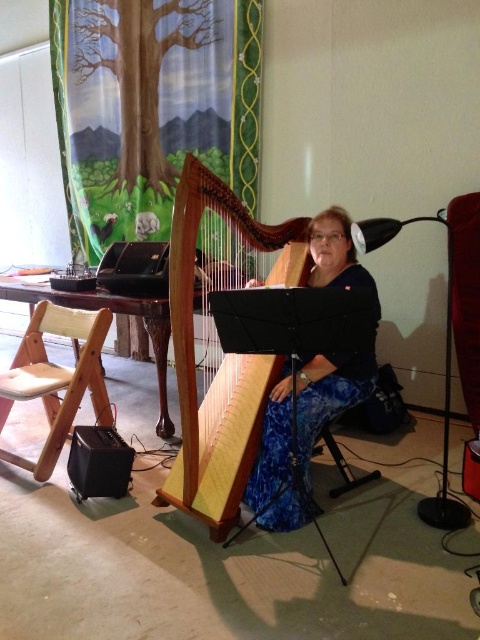
Is blue floral pants at center to the right of light wood folding chair at left from the viewer's perspective?

Correct, you'll find blue floral pants at center to the right of light wood folding chair at left.

Can you confirm if blue floral pants at center is taller than light wood folding chair at left?

In fact, blue floral pants at center may be shorter than light wood folding chair at left.

Which is behind, point (314, 378) or point (36, 396)?

Positioned behind is point (36, 396).

Find the location of `blue floral pants at center`. blue floral pants at center is located at coordinates (330, 396).

Find the location of `wooden harp at center`. wooden harp at center is located at coordinates (218, 346).

Is the position of wooden harp at center less distant than that of light wood folding chair at left?

Yes, it is in front of light wood folding chair at left.

Describe the element at coordinates (218, 346) in the screenshot. I see `wooden harp at center` at that location.

You are a GUI agent. You are given a task and a screenshot of the screen. Output one action in this format:
    pyautogui.click(x=<x>, y=<y>)
    Task: Click on the wooden harp at center
    This screenshot has height=640, width=480.
    Given the screenshot: What is the action you would take?
    pyautogui.click(x=218, y=346)